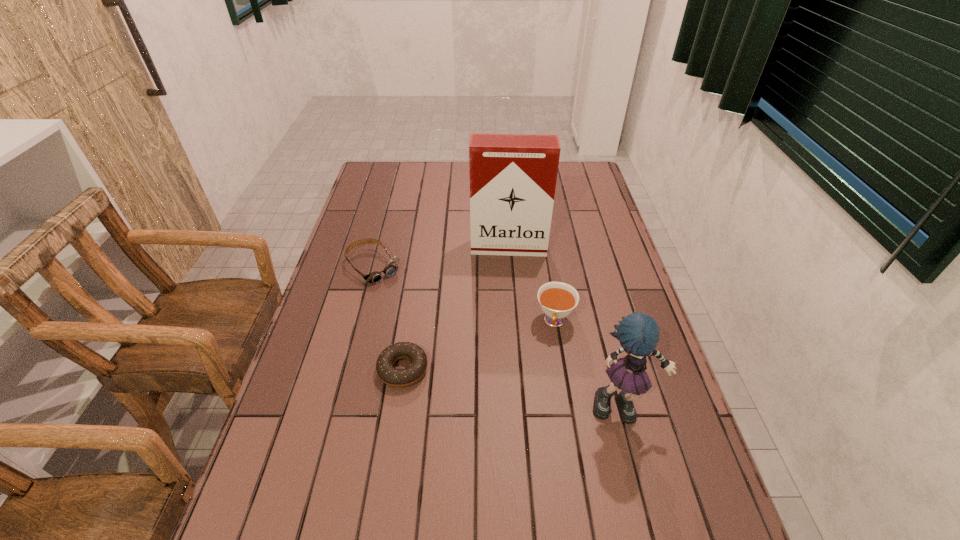
The height and width of the screenshot is (540, 960). In order to click on free space located 0.280m on the side of the teacup with the handle in this screenshot , I will do `click(534, 433)`.

Where is `vacant area situated on the front-facing side of the tallest object`? vacant area situated on the front-facing side of the tallest object is located at coordinates (508, 269).

This screenshot has height=540, width=960. What are the coordinates of `vacant space situated on the front-facing side of the tallest object` in the screenshot? It's located at (508, 339).

The image size is (960, 540). I want to click on vacant space located 0.050m on the front-facing side of the tallest object, so click(x=508, y=267).

Where is `vacant space located 0.190m on the front-facing side of the second shortest object`? The height and width of the screenshot is (540, 960). vacant space located 0.190m on the front-facing side of the second shortest object is located at coordinates (421, 319).

This screenshot has height=540, width=960. I want to click on vacant position located on the front-facing side of the second shortest object, so click(431, 330).

Find the location of `free location located on the front-facing side of the second shortest object`. free location located on the front-facing side of the second shortest object is located at coordinates (418, 315).

Find the location of `object present at the left edge`. object present at the left edge is located at coordinates (375, 277).

Where is `object present at the right edge`? object present at the right edge is located at coordinates (638, 333).

In the image, there is a desktop. In order to click on vacant space at the far edge in this screenshot , I will do `click(420, 184)`.